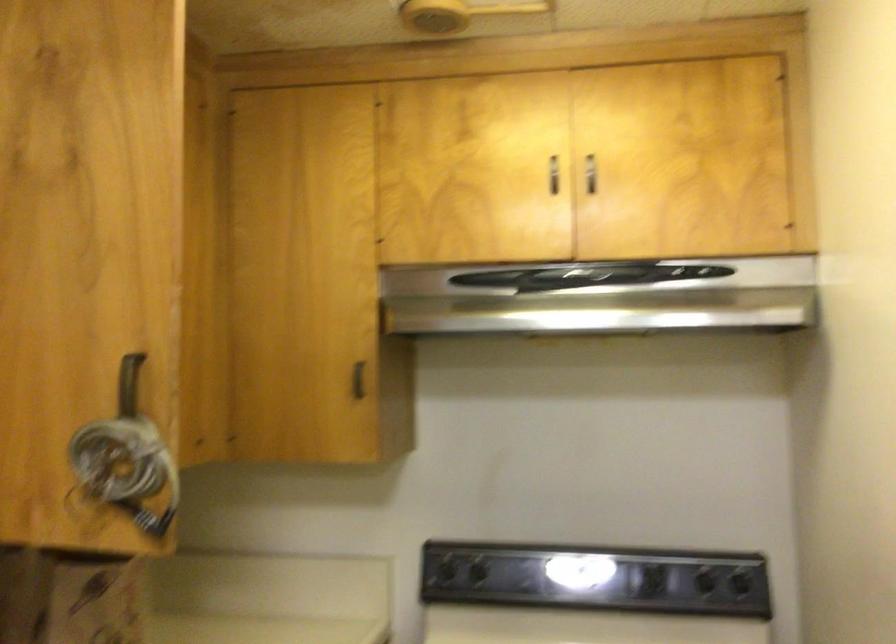
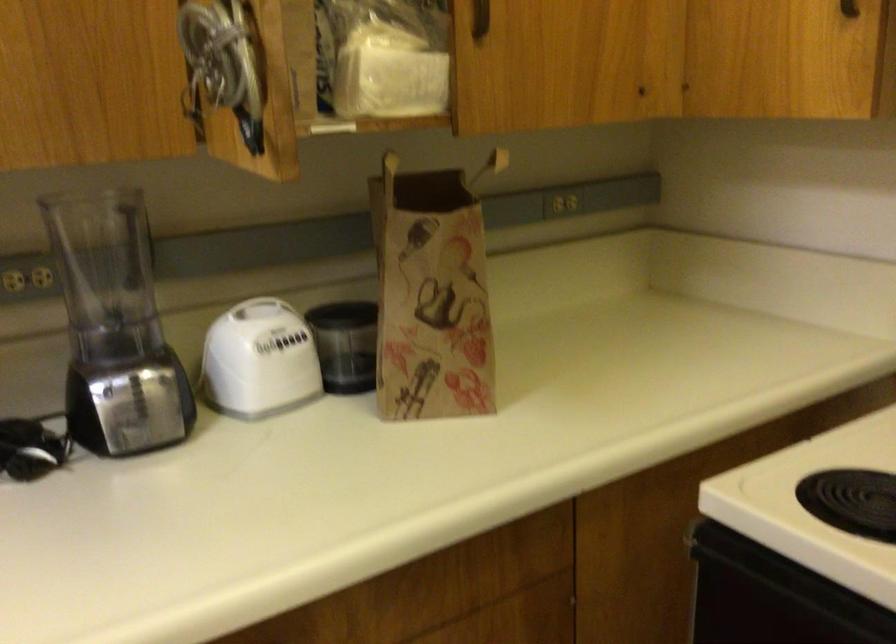
Locate, in the second image, the point that corresponds to point 359,404 in the first image.

(849, 8)